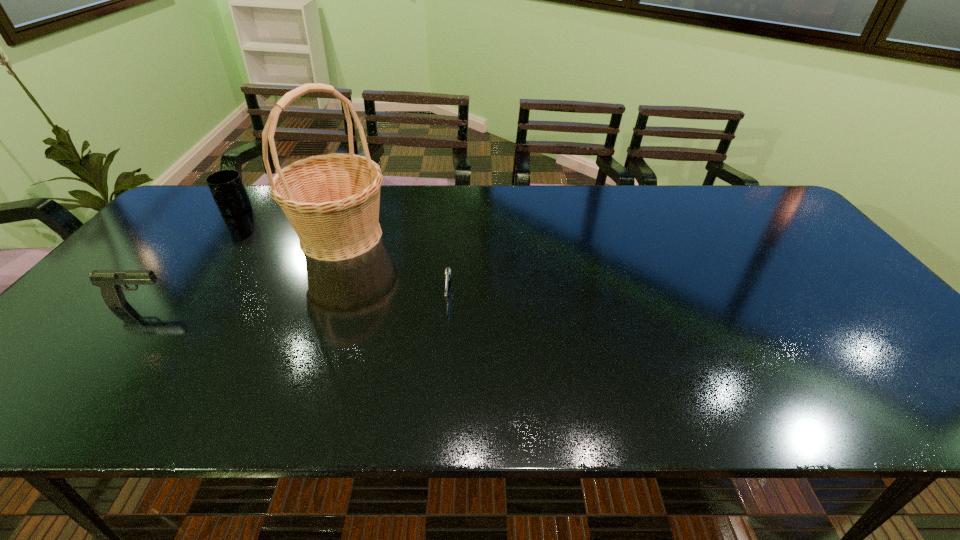
Locate an element on the screen. This screenshot has width=960, height=540. unoccupied position between the mug and the taller pistol is located at coordinates (187, 258).

Where is `free space that is in between the mug and the basket`? free space that is in between the mug and the basket is located at coordinates (288, 224).

Where is `vacant area that lies between the taller pistol and the mug`? This screenshot has width=960, height=540. vacant area that lies between the taller pistol and the mug is located at coordinates (187, 258).

Find the location of a particular element. This screenshot has width=960, height=540. unoccupied area between the rightmost object and the tallest object is located at coordinates (395, 264).

At what (x,y) coordinates should I click in order to perform the action: click on vacant space that's between the third object from left to right and the shorter pistol. Please return your answer as a coordinate pair (x, y). Image resolution: width=960 pixels, height=540 pixels. Looking at the image, I should click on (395, 264).

The height and width of the screenshot is (540, 960). Identify the location of blank region between the mug and the left pistol. (187, 258).

Where is `free space between the taller pistol and the basket`? Image resolution: width=960 pixels, height=540 pixels. free space between the taller pistol and the basket is located at coordinates (241, 269).

The height and width of the screenshot is (540, 960). I want to click on vacant area between the taller pistol and the shortest object, so click(294, 298).

Locate which object is the closest to the mug. Please provide its 2D coordinates. Your answer should be formatted as a tuple, i.e. [(x, y)], where the tuple contains the x and y coordinates of a point satisfying the conditions above.

[(332, 201)]

At what (x,y) coordinates should I click in order to perform the action: click on object that is the second closest to the rightmost object. Please return your answer as a coordinate pair (x, y). Image resolution: width=960 pixels, height=540 pixels. Looking at the image, I should click on (110, 281).